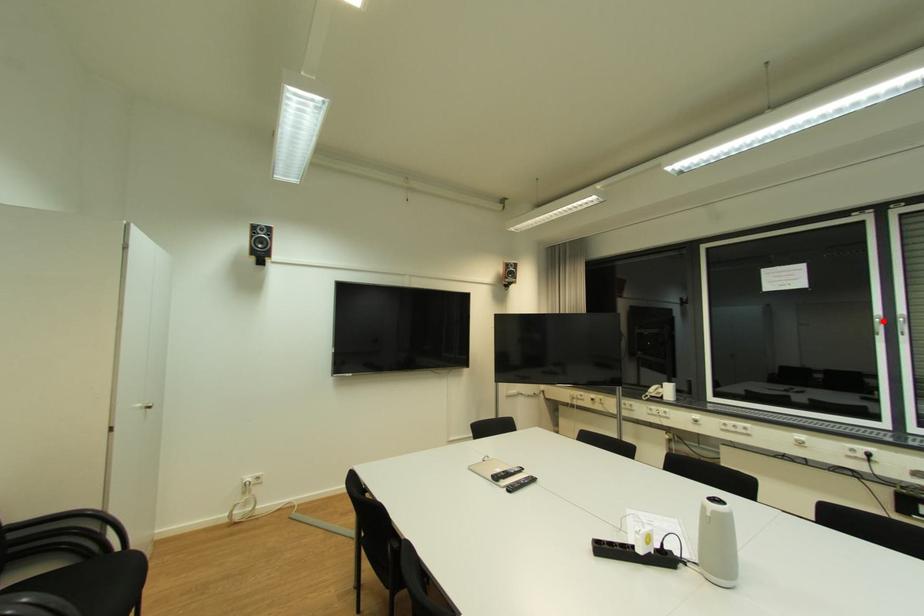
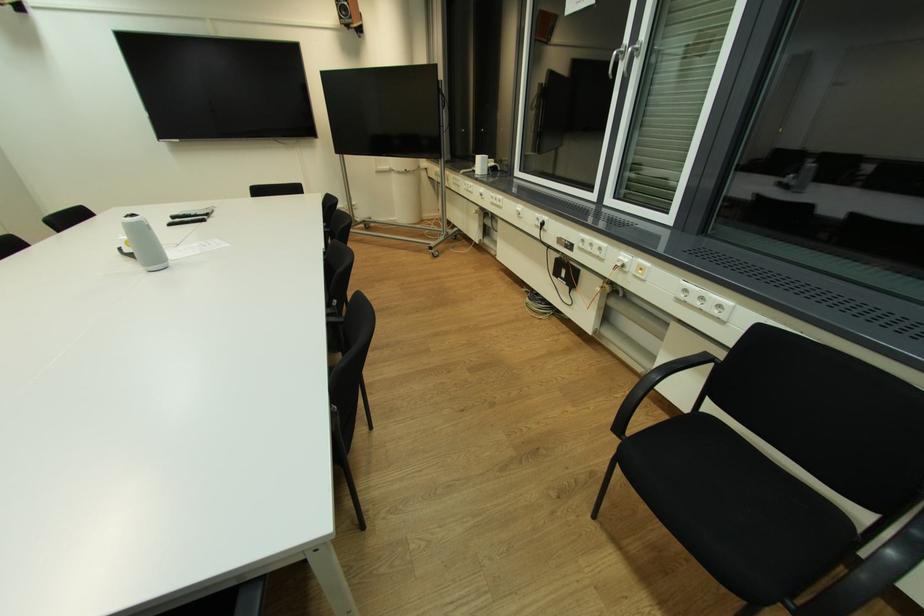
The point at the highlighted location is marked in the first image. Where is the corresponding point in the second image?

(621, 54)